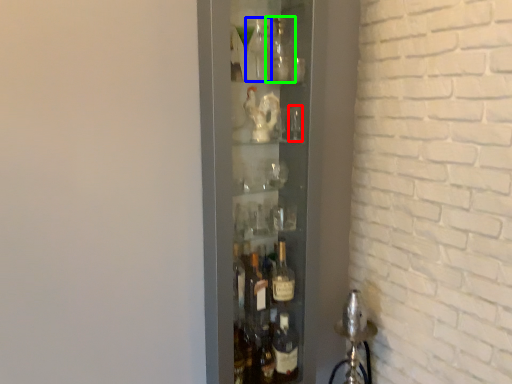
Question: Which is farther away from shot glass (highlighted by a red box)? bottle (highlighted by a blue box) or bottle (highlighted by a green box)?

Choices:
 (A) bottle
 (B) bottle

Answer: (A)